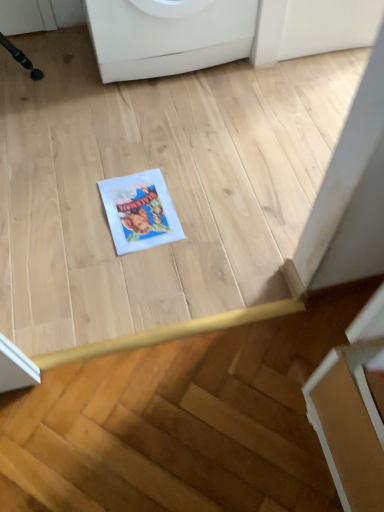
Question: Considering the relative positions of white paper comic book at center and white glossy washing machine at upper center in the image provided, is white paper comic book at center to the right of white glossy washing machine at upper center from the viewer's perspective?

Choices:
 (A) yes
 (B) no

Answer: (B)

Question: Is white paper comic book at center further to camera compared to white glossy washing machine at upper center?

Choices:
 (A) no
 (B) yes

Answer: (A)

Question: From the image's perspective, is white paper comic book at center over white glossy washing machine at upper center?

Choices:
 (A) yes
 (B) no

Answer: (B)

Question: Could you tell me if white paper comic book at center is facing white glossy washing machine at upper center?

Choices:
 (A) yes
 (B) no

Answer: (B)

Question: Is white paper comic book at center shorter than white glossy washing machine at upper center?

Choices:
 (A) yes
 (B) no

Answer: (A)

Question: Is white paper comic book at center closer to the viewer compared to white glossy washing machine at upper center?

Choices:
 (A) yes
 (B) no

Answer: (A)

Question: Is white glossy washing machine at upper center bigger than white paper comic book at center?

Choices:
 (A) yes
 (B) no

Answer: (A)

Question: Can you confirm if white glossy washing machine at upper center is positioned to the right of white paper comic book at center?

Choices:
 (A) no
 (B) yes

Answer: (B)

Question: From a real-world perspective, is white glossy washing machine at upper center physically below white paper comic book at center?

Choices:
 (A) yes
 (B) no

Answer: (B)

Question: From a real-world perspective, is white glossy washing machine at upper center on white paper comic book at center?

Choices:
 (A) no
 (B) yes

Answer: (B)

Question: From the image's perspective, would you say white glossy washing machine at upper center is positioned over white paper comic book at center?

Choices:
 (A) yes
 (B) no

Answer: (A)

Question: Is white glossy washing machine at upper center not near white paper comic book at center?

Choices:
 (A) no
 (B) yes

Answer: (A)

Question: Relative to white paper comic book at center, is white glossy washing machine at upper center in front or behind?

Choices:
 (A) behind
 (B) front

Answer: (A)